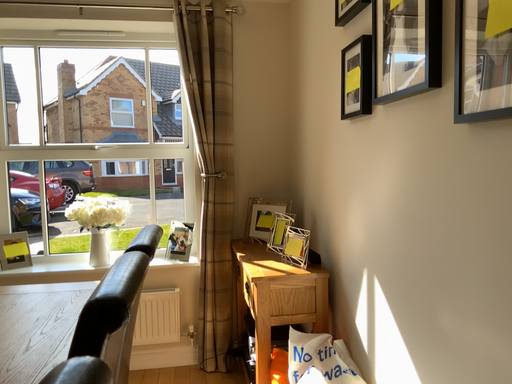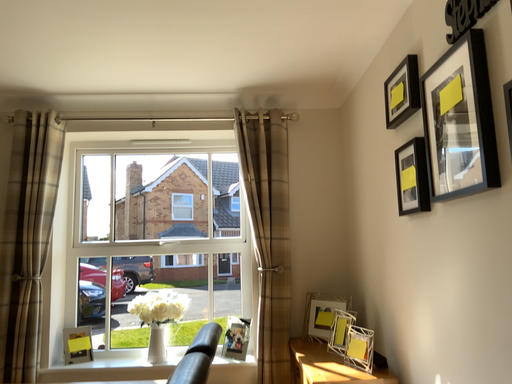
Question: How did the camera likely rotate when shooting the video?

Choices:
 (A) rotated downward
 (B) rotated upward

Answer: (B)